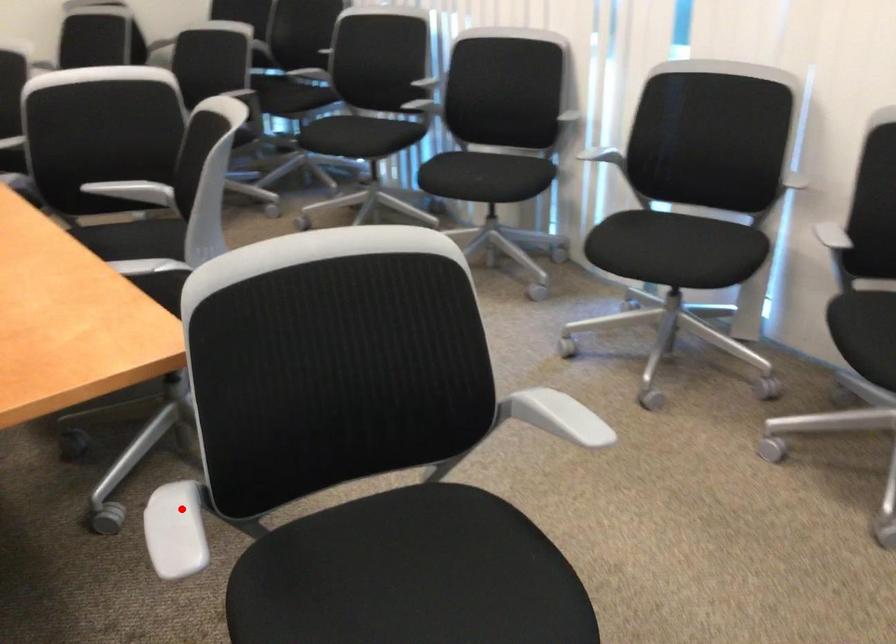
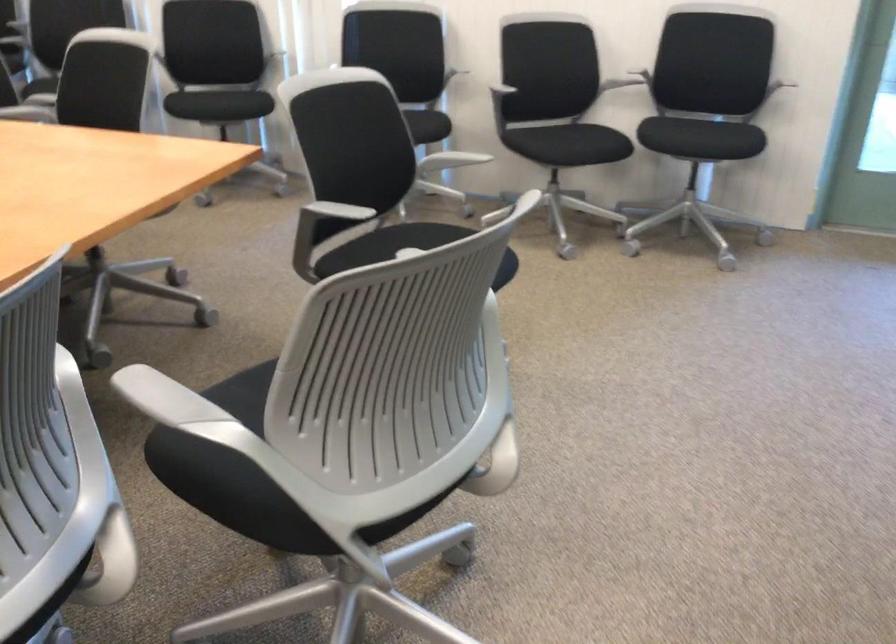
In the second image, find the point that corresponds to the highlighted location in the first image.

(332, 212)